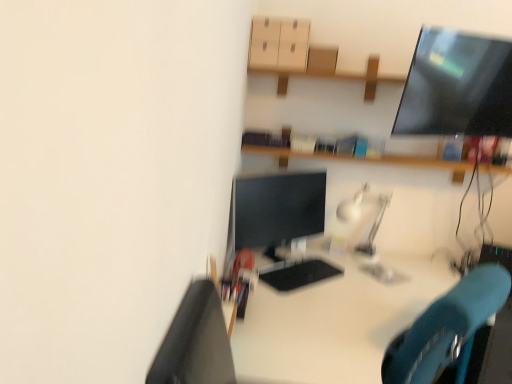
This screenshot has width=512, height=384. What are the coordinates of `vacant space underneath matte black monitor at center (from a real-world perspective)` in the screenshot? It's located at (275, 257).